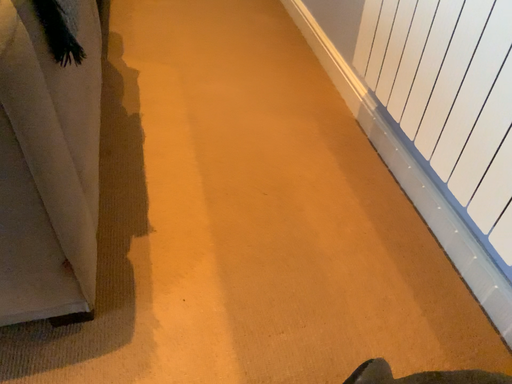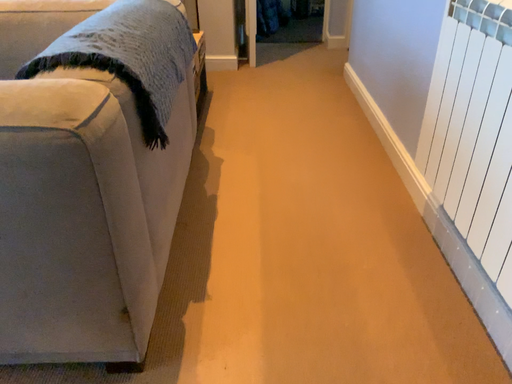
Question: How did the camera likely rotate when shooting the video?

Choices:
 (A) rotated left
 (B) rotated right

Answer: (A)